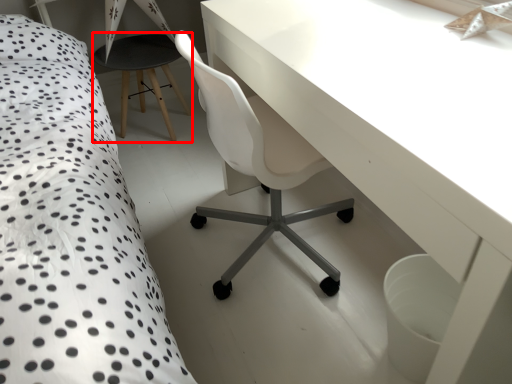
Question: In this image, where is bar stool (annotated by the red box) located relative to table?

Choices:
 (A) right
 (B) left

Answer: (B)